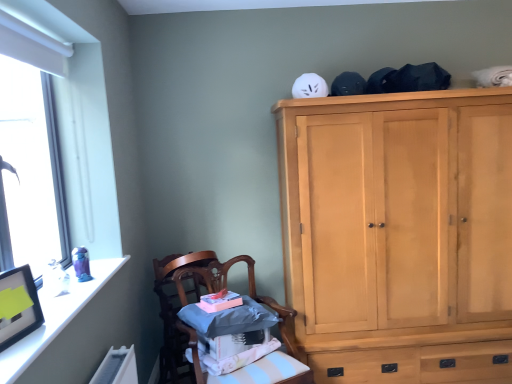
The width and height of the screenshot is (512, 384). In order to click on free space above white glossy frame at upper left (from a real-world perspective) in this screenshot , I will do `click(71, 298)`.